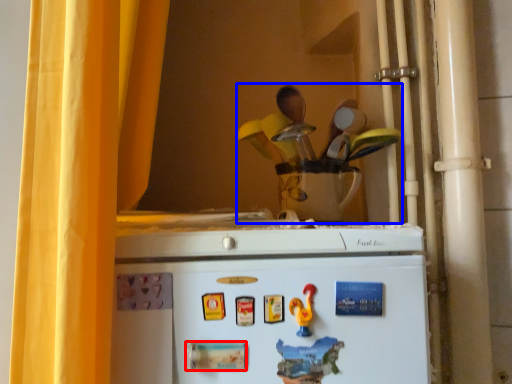
Question: Which object appears closest to the camera in this image, magnet (highlighted by a red box) or toy (highlighted by a blue box)?

Choices:
 (A) magnet
 (B) toy

Answer: (A)